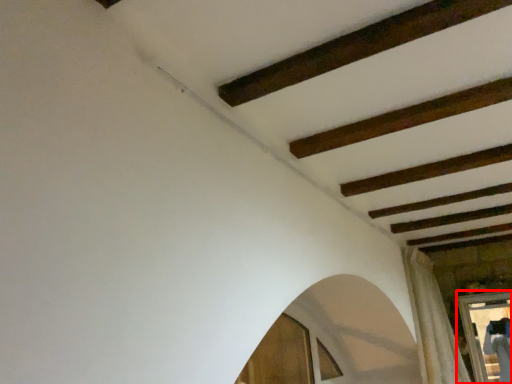
Question: Considering the relative positions of window frame (annotated by the red box) and curtain in the image provided, where is window frame (annotated by the red box) located with respect to the staircase?

Choices:
 (A) left
 (B) right

Answer: (B)